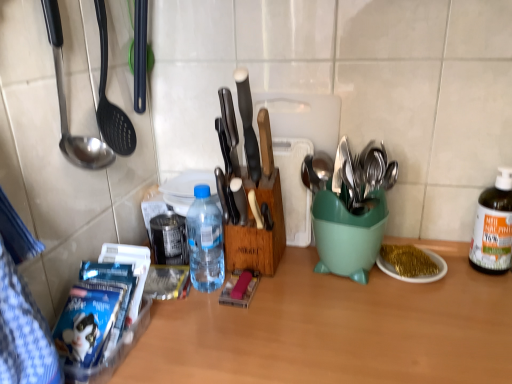
The image size is (512, 384). Identify the location of vacant area located to the right-hand side of gold glitter plate at right. (469, 279).